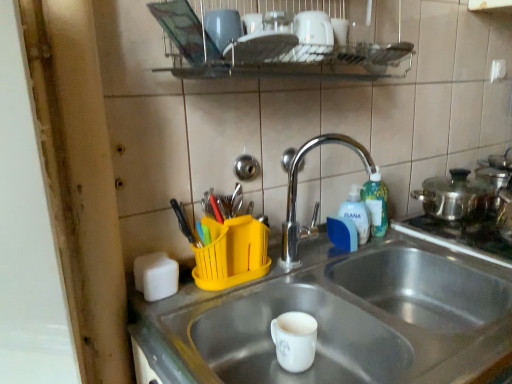
Find the location of a particular element. The width and height of the screenshot is (512, 384). vacant area that lies to the right of green translucent bottle at right, which is the second bottle in left-to-right order is located at coordinates (419, 240).